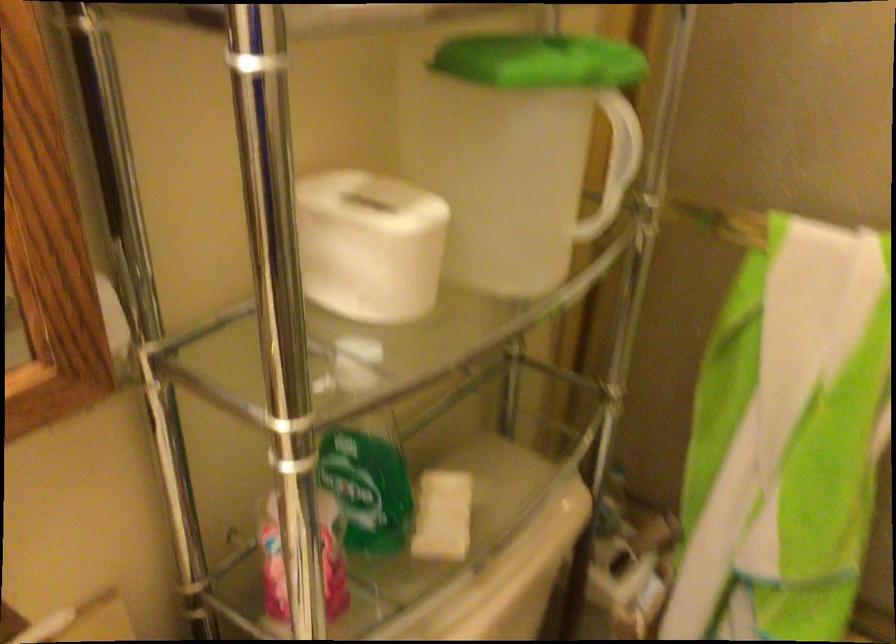
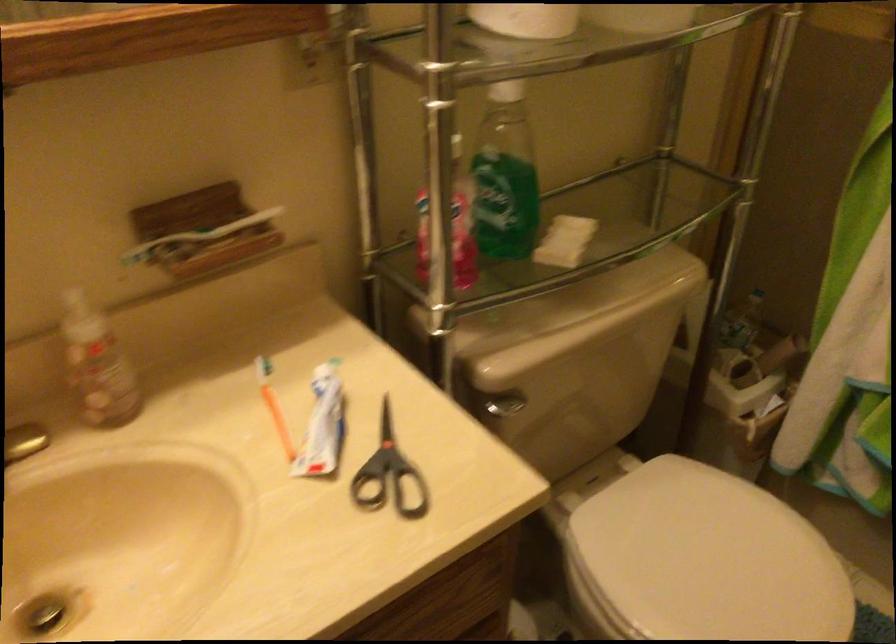
In the second image, find the point that corresponds to the point at 645,545 in the first image.

(764, 361)